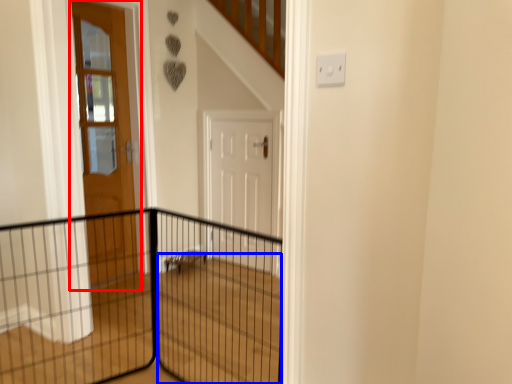
Question: Which of the following is the farthest to the observer, door (highlighted by a red box) or stairwell (highlighted by a blue box)?

Choices:
 (A) door
 (B) stairwell

Answer: (A)